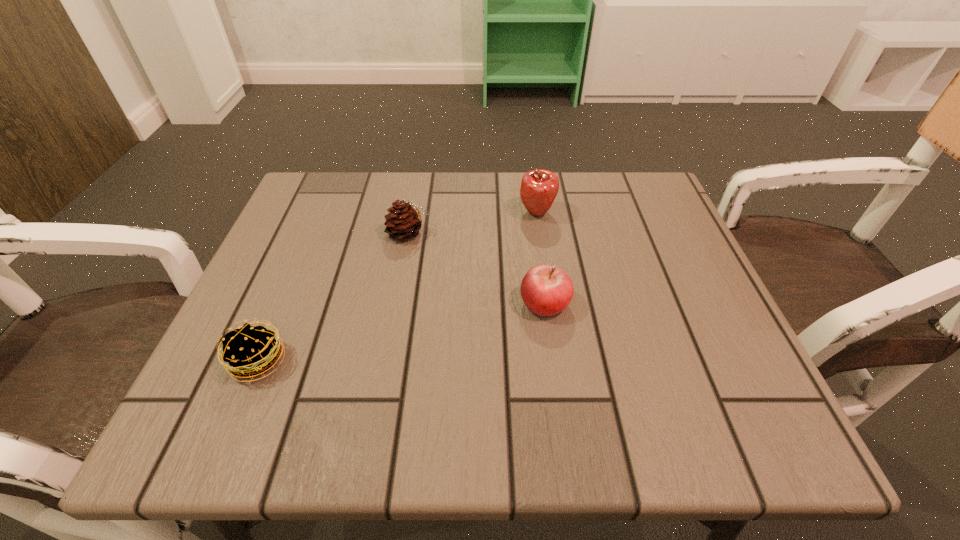
Image resolution: width=960 pixels, height=540 pixels. I want to click on the farther apple, so click(x=539, y=188).

Identify the location of the tallest object. Image resolution: width=960 pixels, height=540 pixels. (539, 188).

Where is `the second object from left to right`? the second object from left to right is located at coordinates (402, 223).

This screenshot has width=960, height=540. Identify the location of the second nearest object. (546, 290).

I want to click on the nearer apple, so click(x=546, y=290).

Locate an element on the screen. This screenshot has height=540, width=960. patty is located at coordinates (251, 350).

Identify the location of the leftmost object. This screenshot has height=540, width=960. (251, 350).

Where is `vacant region located 0.250m on the front of the farther apple`? The height and width of the screenshot is (540, 960). vacant region located 0.250m on the front of the farther apple is located at coordinates (552, 312).

The image size is (960, 540). Identify the location of free region located with a leaf charm attached to the pinecone. 576,233.

At what (x,y) coordinates should I click in order to perform the action: click on free space located on the back of the third farthest object. Please return your answer as a coordinate pair (x, y). This screenshot has width=960, height=540. Looking at the image, I should click on (531, 204).